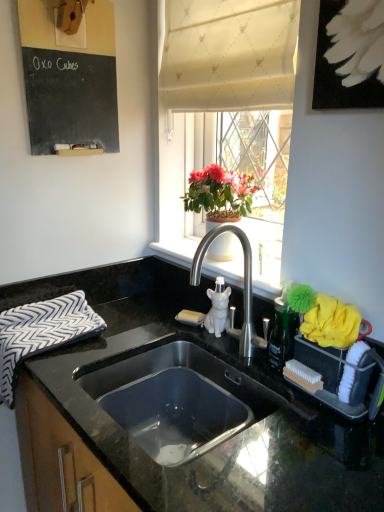
Question: Considering the positions of black granite countertop at center and black and white zigzag fabric hand towel at left in the image, is black granite countertop at center taller or shorter than black and white zigzag fabric hand towel at left?

Choices:
 (A) short
 (B) tall

Answer: (B)

Question: From a real-world perspective, is black granite countertop at center physically located above or below black and white zigzag fabric hand towel at left?

Choices:
 (A) below
 (B) above

Answer: (A)

Question: Which is farther from the black chalkboard at upper left?

Choices:
 (A) white ceramic window sill at upper center
 (B) green leafy plant at upper center
 (C) black granite countertop at center
 (D) white textured curtain at upper center
 (E) black and white zigzag fabric hand towel at left

Answer: (C)

Question: Considering the real-world distances, which object is closest to the black and white zigzag fabric hand towel at left?

Choices:
 (A) white fabric at upper center
 (B) black chalkboard at upper left
 (C) white textured curtain at upper center
 (D) green leafy plant at upper center
 (E) white ceramic window sill at upper center

Answer: (E)